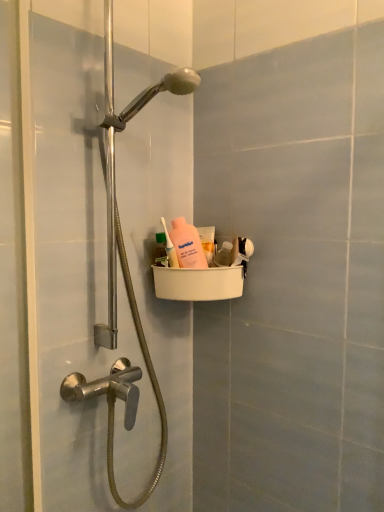
Question: From a real-world perspective, relative to pink matte bottle at center, the second mouthwash from the left, is white plastic basket at upper center vertically above or below?

Choices:
 (A) above
 (B) below

Answer: (B)

Question: Is point (19, 185) positioned closer to the camera than point (198, 228)?

Choices:
 (A) farther
 (B) closer

Answer: (B)

Question: Which is nearer to the pink matte bottle at center, the first mouthwash positioned from the back?

Choices:
 (A) pink matte bottle at upper center
 (B) green plastic bottle at upper center, which is the 2th mouthwash from back to front
 (C) white plastic basket at upper center

Answer: (A)

Question: Estimate the real-world distances between objects in this image. Which object is farther from the pink matte bottle at center, acting as the second mouthwash starting from the front?

Choices:
 (A) green plastic bottle at upper center, which is the 1th mouthwash in front-to-back order
 (B) pink matte bottle at upper center
 (C) white plastic basket at upper center

Answer: (C)